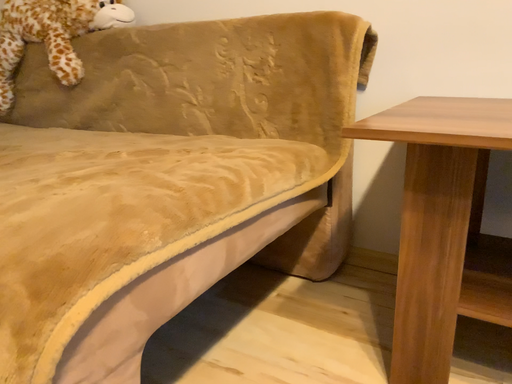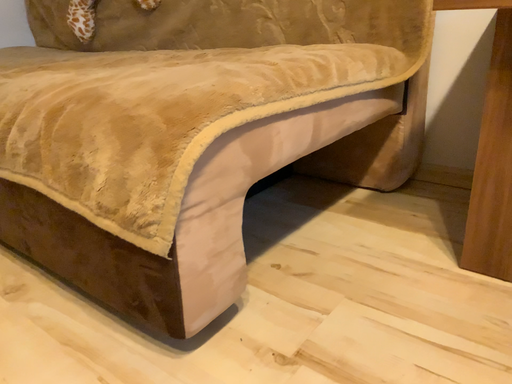
Question: Which way did the camera rotate in the video?

Choices:
 (A) rotated right
 (B) rotated left

Answer: (B)